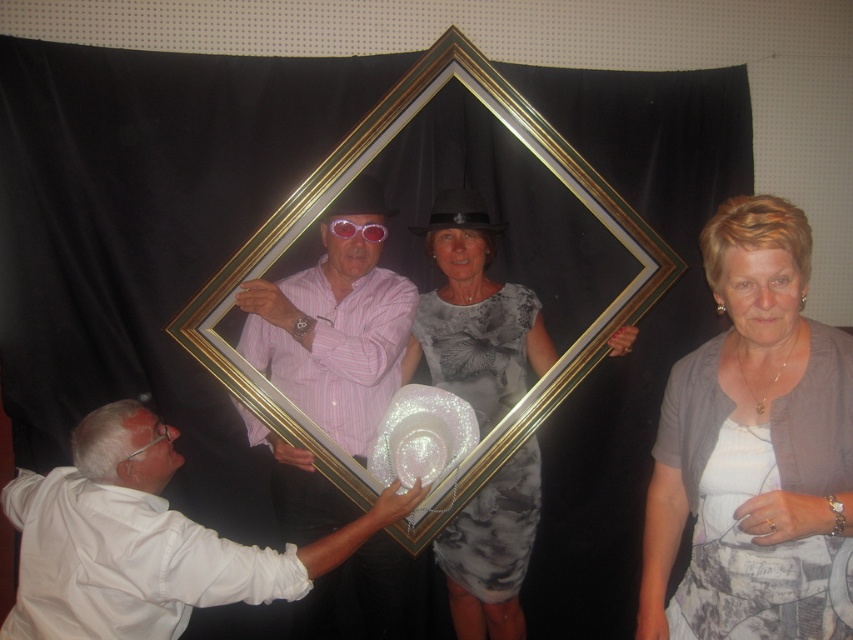
Based on the scene, can you determine if the gold metallic picture frame at center is wider than the pink striped shirt at center?

The gold metallic picture frame at center is wider than the pink striped shirt at center according to the description.

You are a photographer trying to adjust the lighting for a photo shoot. You notice the white matte hat at lower left and the gold metallic picture frame at center are casting shadows. Which object is closer to the light source?

The white matte hat at lower left and gold metallic picture frame at center are 20.04 inches apart from each other. Since the object closer to the light source casts a larger shadow, but the distance between them doesn not indicate which is closer, we cannot determine which is closer based on the given information.

You are a photographer trying to capture a photo of the gold metallic picture frame at center and the gray textured dress at center. Which object should you focus on first to ensure it appears sharp in the photo?

The gold metallic picture frame at center is closer to the viewer than the gray textured dress at center, so you should focus on the gold metallic picture frame at center first to ensure it appears sharp.